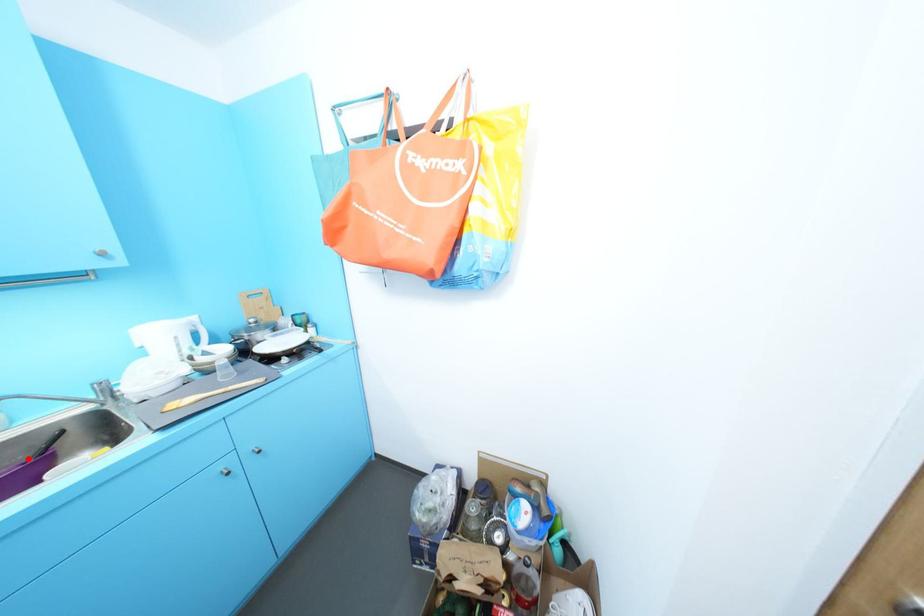
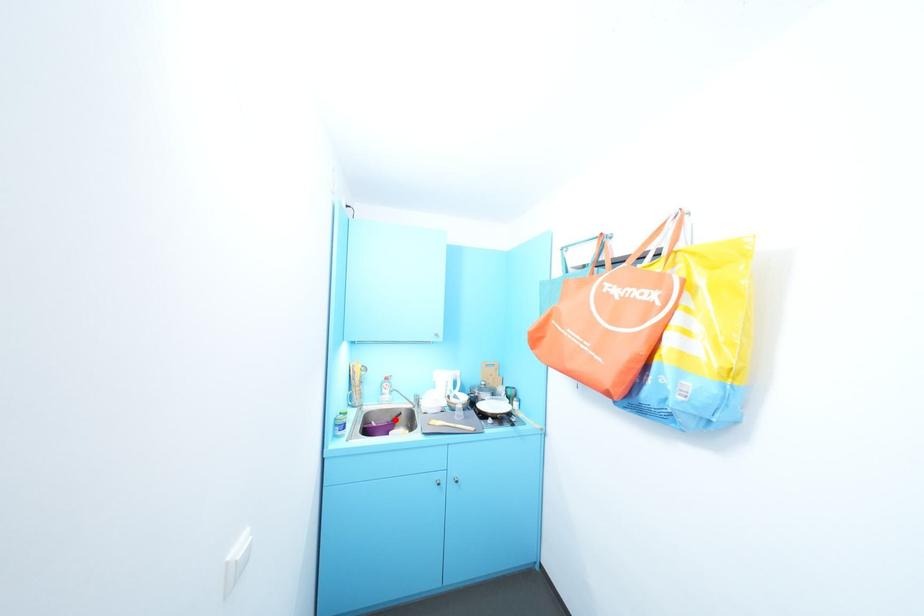
I am providing you with two images of the same scene from different viewpoints. A red point is marked on the first image and another point is marked on the second image. Do the highlighted points in image1 and image2 indicate the same real-world spot?

Yes